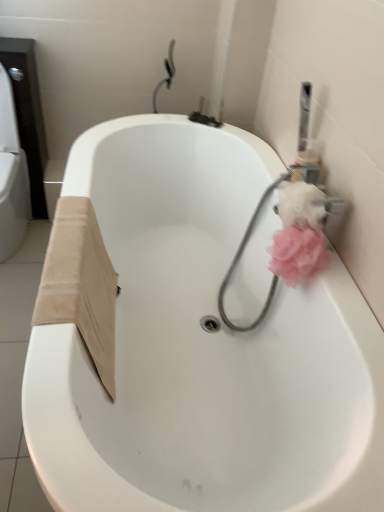
Question: Is pink fluffy toilet paper at upper right wider than white glossy bathtub at center?

Choices:
 (A) no
 (B) yes

Answer: (A)

Question: Are pink fluffy toilet paper at upper right and white glossy bathtub at center making contact?

Choices:
 (A) yes
 (B) no

Answer: (B)

Question: Is pink fluffy toilet paper at upper right looking in the opposite direction of white glossy bathtub at center?

Choices:
 (A) no
 (B) yes

Answer: (A)

Question: Can you confirm if pink fluffy toilet paper at upper right is bigger than white glossy bathtub at center?

Choices:
 (A) yes
 (B) no

Answer: (B)

Question: Is pink fluffy toilet paper at upper right closer to camera compared to white glossy bathtub at center?

Choices:
 (A) no
 (B) yes

Answer: (A)

Question: Is pink fluffy toilet paper at upper right located outside white glossy bathtub at center?

Choices:
 (A) yes
 (B) no

Answer: (A)

Question: Can you confirm if pink fabric bath puff at right is positioned to the right of pink fluffy toilet paper at upper right?

Choices:
 (A) yes
 (B) no

Answer: (B)

Question: Is pink fabric bath puff at right closer to camera compared to pink fluffy toilet paper at upper right?

Choices:
 (A) yes
 (B) no

Answer: (B)

Question: Is pink fabric bath puff at right outside of pink fluffy toilet paper at upper right?

Choices:
 (A) yes
 (B) no

Answer: (A)

Question: From the image's perspective, would you say pink fabric bath puff at right is positioned over pink fluffy toilet paper at upper right?

Choices:
 (A) yes
 (B) no

Answer: (B)

Question: Does pink fabric bath puff at right appear on the left side of pink fluffy toilet paper at upper right?

Choices:
 (A) yes
 (B) no

Answer: (A)

Question: Is pink fluffy toilet paper at upper right completely or partially inside pink fabric bath puff at right?

Choices:
 (A) no
 (B) yes

Answer: (A)

Question: From a real-world perspective, is white glossy bathtub at center on pink fluffy toilet paper at upper right?

Choices:
 (A) no
 (B) yes

Answer: (A)